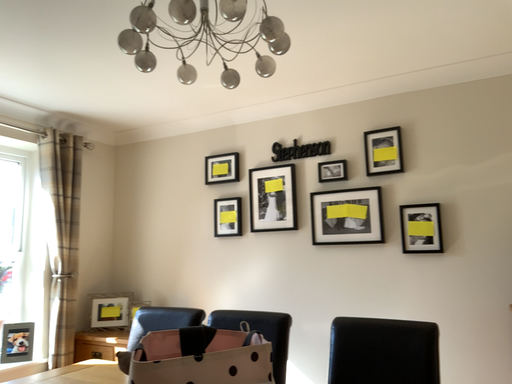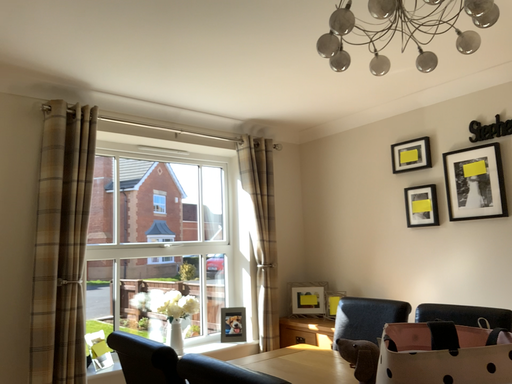
Question: Which way did the camera rotate in the video?

Choices:
 (A) rotated right
 (B) rotated left

Answer: (B)